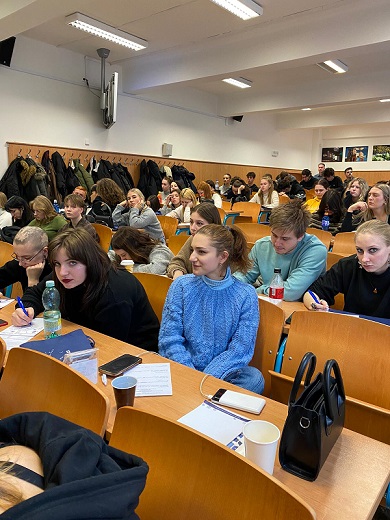
Locate an element on the screen. Image resolution: width=390 pixels, height=520 pixels. bottles is located at coordinates tap(47, 301), tap(278, 289), tap(324, 223).